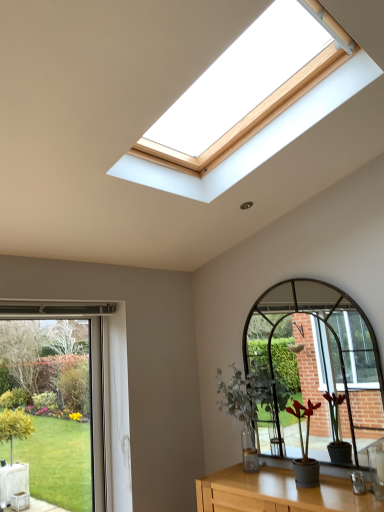
Question: Would you say green glass window at lower left is to the left or to the right of green matte plant at center, which is counted as the 1th houseplant, starting from the right, in the picture?

Choices:
 (A) right
 (B) left

Answer: (B)

Question: From the image's perspective, is green glass window at lower left above or below green matte plant at center, which is the first houseplant in front-to-back order?

Choices:
 (A) below
 (B) above

Answer: (B)

Question: Which of these objects is positioned farthest from the green matte plant at center, marked as the 2th houseplant in a front-to-back arrangement?

Choices:
 (A) green matte plant at center, which is the first houseplant in front-to-back order
 (B) green glass window at lower left
 (C) wooden table at lower center

Answer: (B)

Question: Considering the real-world distances, which object is farthest from the wooden table at lower center?

Choices:
 (A) green matte plant at center, the second houseplant positioned from the back
 (B) green glass window at lower left
 (C) green matte plant at center, which is the 2th houseplant from right to left

Answer: (B)